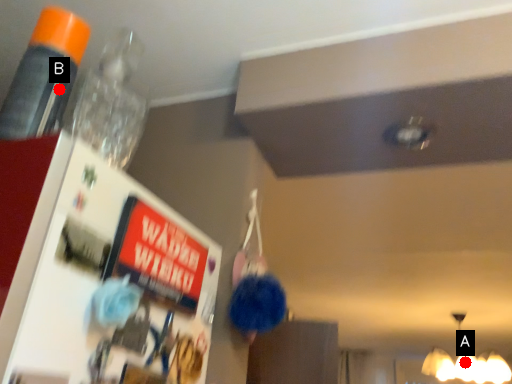
Question: Two points are circled on the image, labeled by A and B beside each circle. Which point is closer to the camera?

Choices:
 (A) A is closer
 (B) B is closer

Answer: (B)